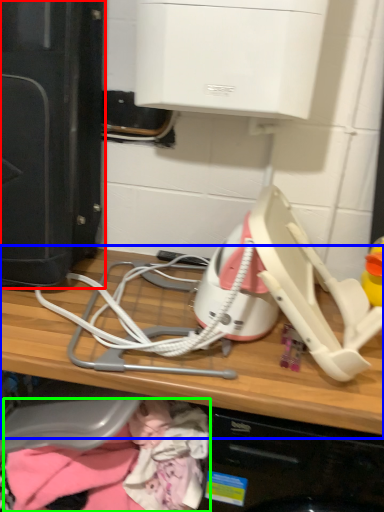
Question: Estimate the real-world distances between objects in this image. Which object is farther from home appliance (highlighted by a red box), computer (highlighted by a blue box) or clothing (highlighted by a green box)?

Choices:
 (A) computer
 (B) clothing

Answer: (B)